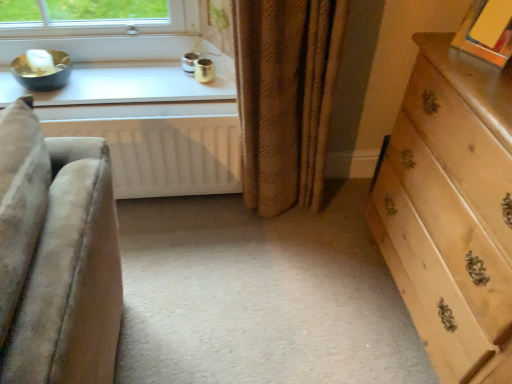
Question: Can you confirm if white matte radiator at lower center is wider than white glossy window sill at upper left?

Choices:
 (A) no
 (B) yes

Answer: (A)

Question: Could you tell me if white matte radiator at lower center is turned towards white glossy window sill at upper left?

Choices:
 (A) yes
 (B) no

Answer: (B)

Question: Considering the relative positions of white matte radiator at lower center and white glossy window sill at upper left in the image provided, is white matte radiator at lower center to the right of white glossy window sill at upper left from the viewer's perspective?

Choices:
 (A) yes
 (B) no

Answer: (A)

Question: Is white matte radiator at lower center not near white glossy window sill at upper left?

Choices:
 (A) no
 (B) yes

Answer: (A)

Question: From the image's perspective, is white matte radiator at lower center on white glossy window sill at upper left?

Choices:
 (A) no
 (B) yes

Answer: (A)

Question: From a real-world perspective, is white matte radiator at lower center physically above white glossy window sill at upper left?

Choices:
 (A) no
 (B) yes

Answer: (A)

Question: Can you confirm if brown textured curtain at center is thinner than white glossy window sill at upper left?

Choices:
 (A) no
 (B) yes

Answer: (A)

Question: From a real-world perspective, is brown textured curtain at center under white glossy window sill at upper left?

Choices:
 (A) no
 (B) yes

Answer: (B)

Question: From the image's perspective, is brown textured curtain at center under white glossy window sill at upper left?

Choices:
 (A) yes
 (B) no

Answer: (A)

Question: Is the depth of brown textured curtain at center less than that of white glossy window sill at upper left?

Choices:
 (A) no
 (B) yes

Answer: (B)

Question: Does brown textured curtain at center turn towards white glossy window sill at upper left?

Choices:
 (A) no
 (B) yes

Answer: (A)

Question: Are brown textured curtain at center and white glossy window sill at upper left located far from each other?

Choices:
 (A) yes
 (B) no

Answer: (B)

Question: From the image's perspective, is white glossy window sill at upper left above white matte radiator at lower center?

Choices:
 (A) no
 (B) yes

Answer: (B)